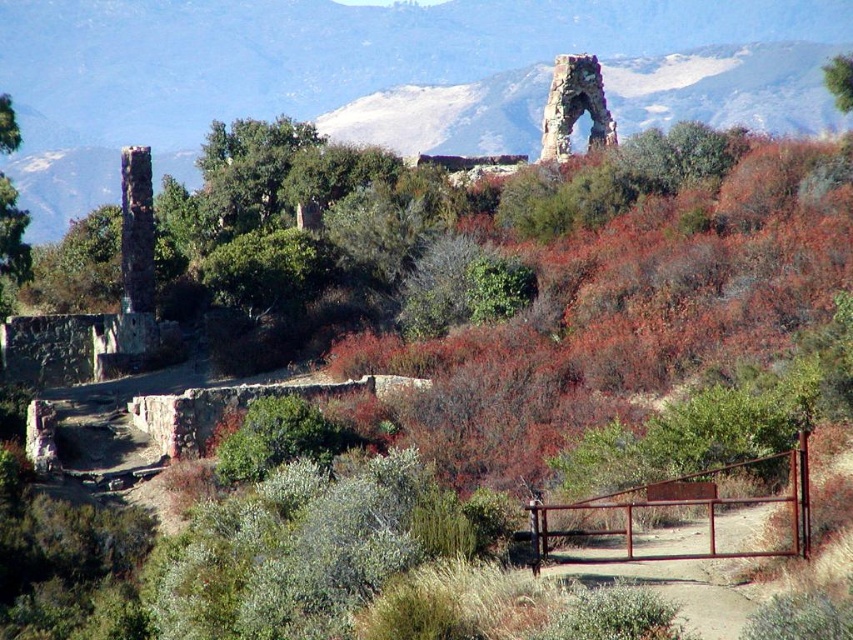
Does point (612, 534) lie in front of point (566, 138)?

Yes.

The width and height of the screenshot is (853, 640). What do you see at coordinates (679, 506) in the screenshot? I see `rusty metal gate at lower right` at bounding box center [679, 506].

Does point (784, 458) come farther from viewer compared to point (544, 154)?

No, it is not.

What are the coordinates of `rusty metal gate at lower right` in the screenshot? It's located at (679, 506).